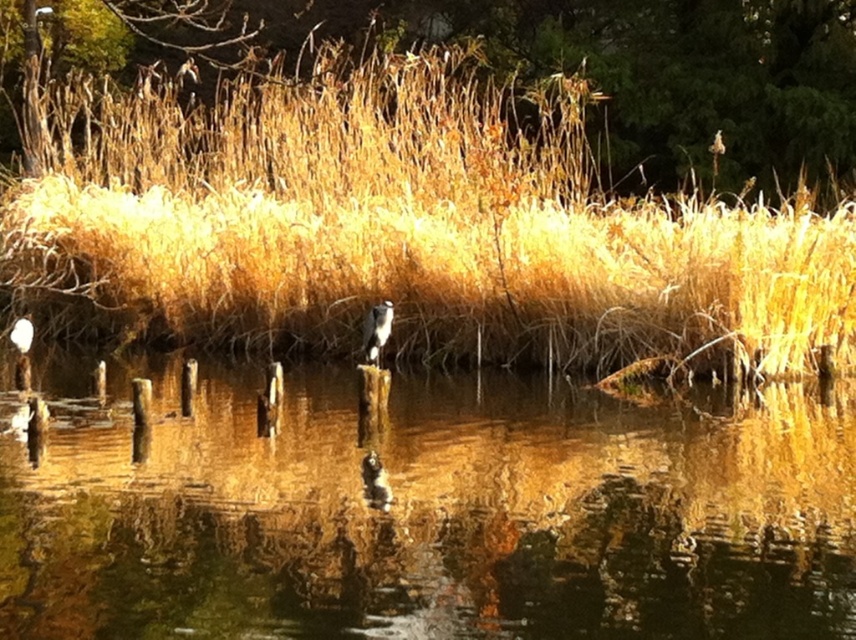
You are standing in the serene natural scene and want to walk from the point closer to you to the point further away. Which path would you take between the two points, point (238,406) and point (851,134)?

The path from point (238,406) to point (851,134) would be the direct route between them, as point (238,406) is closer to the viewer and point (851,134) is further away.

You are standing in the serene natural scene and want to walk from the point at coordinates point (733, 147) to the point at coordinates point (364, 323). Which direction should you move relative to your current position?

You should move towards the camera because point (733, 147) is further away from the camera than point (364, 323). Since point (364, 323) is closer to the camera, moving towards it would mean moving in the direction of the camera.

You are a photographer trying to capture the white fluffy bird at center. To get a better shot, you want to adjust your camera angle so that the brown grass at upper center is partially blocking the view of the bird. Is this possible based on their sizes?

The brown grass at upper center is taller than the white fluffy bird at center, so yes, adjusting the camera angle could allow the brown grass at upper center to partially block the view of the bird since it is taller.